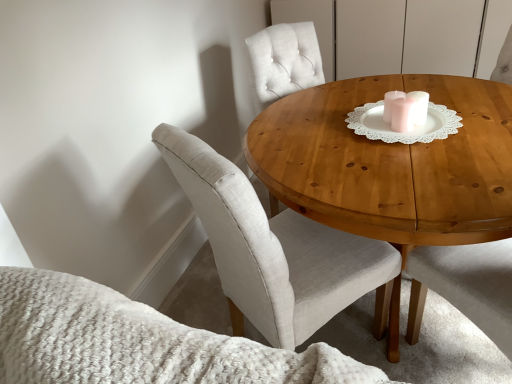
Question: Considering the relative positions of wooden table at center and white lace doily at center in the image provided, is wooden table at center in front of white lace doily at center?

Choices:
 (A) yes
 (B) no

Answer: (A)

Question: From a real-world perspective, is wooden table at center on white lace doily at center?

Choices:
 (A) yes
 (B) no

Answer: (B)

Question: Can you confirm if wooden table at center is wider than white lace doily at center?

Choices:
 (A) no
 (B) yes

Answer: (B)

Question: Does wooden table at center contain white lace doily at center?

Choices:
 (A) yes
 (B) no

Answer: (B)

Question: Is wooden table at center turned away from white lace doily at center?

Choices:
 (A) no
 (B) yes

Answer: (A)

Question: Considering the relative sizes of wooden table at center and white lace doily at center in the image provided, is wooden table at center taller than white lace doily at center?

Choices:
 (A) yes
 (B) no

Answer: (A)

Question: Is light beige fabric chair at center looking in the opposite direction of wooden table at center?

Choices:
 (A) yes
 (B) no

Answer: (A)

Question: Is light beige fabric chair at center next to wooden table at center?

Choices:
 (A) yes
 (B) no

Answer: (B)

Question: Can you confirm if light beige fabric chair at center is bigger than wooden table at center?

Choices:
 (A) yes
 (B) no

Answer: (B)

Question: From the image's perspective, does light beige fabric chair at center appear lower than wooden table at center?

Choices:
 (A) no
 (B) yes

Answer: (B)

Question: Does light beige fabric chair at center lie behind wooden table at center?

Choices:
 (A) no
 (B) yes

Answer: (B)

Question: Is wooden table at center surrounded by light beige fabric chair at center?

Choices:
 (A) yes
 (B) no

Answer: (B)

Question: Can we say white lace doily at center lies outside wooden table at center?

Choices:
 (A) no
 (B) yes

Answer: (B)